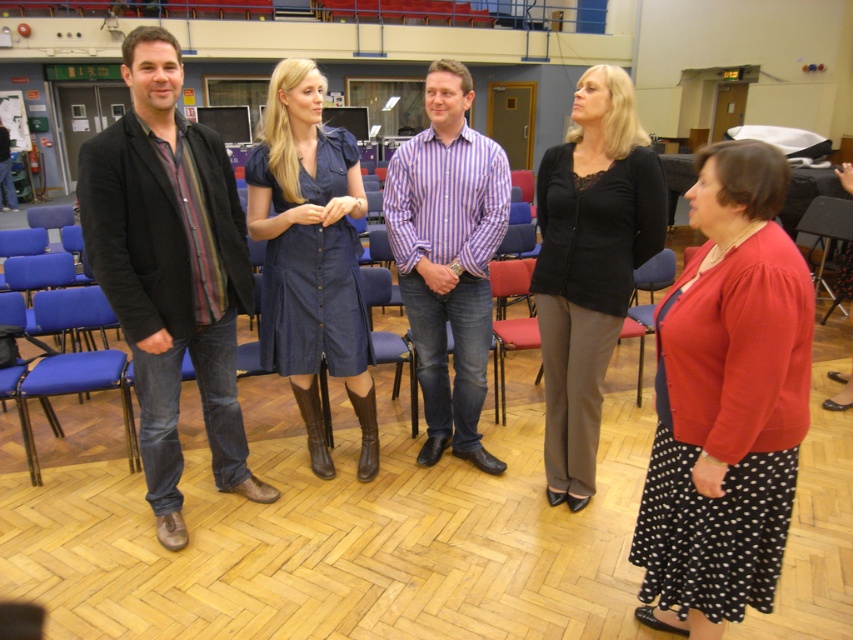
You are organizing a photoshoot and need to ensure that the denim dress at center and the blue fabric chair at left are both visible in the frame. Given their sizes, which object should you prioritize placing closer to the camera to maintain clarity?

The denim dress at center is bigger than the blue fabric chair at left, so you should prioritize placing the denim dress at center closer to the camera to ensure both objects are clearly visible.

You are organizing a formal event and need to ensure that all attendees are dressed appropriately. According to the image, which clothing item is shorter in length between the black dotted skirt at lower right and the matte black blazer at left?

The black dotted skirt at lower right is shorter than the matte black blazer at left, so the skirt is shorter in length.